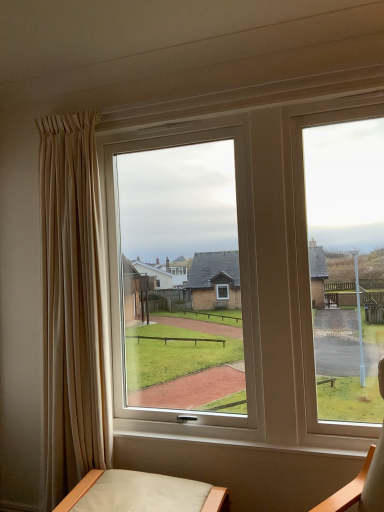
Question: Should I look upward or downward to see leatherette cushioned chair at lower center?

Choices:
 (A) up
 (B) down

Answer: (B)